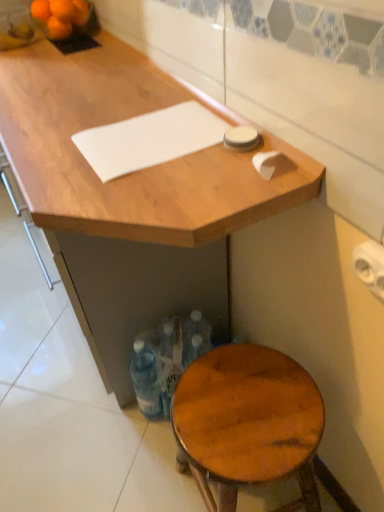
You are a GUI agent. You are given a task and a screenshot of the screen. Output one action in this format:
    pyautogui.click(x=<x>, y=<y>)
    Task: Click on the wooden stool at lower right
    This screenshot has height=512, width=384.
    Given the screenshot: What is the action you would take?
    pyautogui.click(x=247, y=422)

Measure the distance between orange matte tangerine at upper left, the 3th tangerine positioned from the front, and camera.

A distance of 1.39 meters exists between orange matte tangerine at upper left, the 3th tangerine positioned from the front, and camera.

I want to click on orange matte tangerine at upper left, the 3th tangerine positioned from the front, so click(x=80, y=12).

Where is `orange matte tangerine at upper left, acting as the first tangerine starting from the back`? orange matte tangerine at upper left, acting as the first tangerine starting from the back is located at coordinates (60, 16).

How much space does orange matte tangerine at upper left, the fourth tangerine in the front-to-back sequence, occupy horizontally?

It is 6.36 inches.

This screenshot has width=384, height=512. What do you see at coordinates (40, 10) in the screenshot? I see `orange matte at upper left` at bounding box center [40, 10].

The width and height of the screenshot is (384, 512). What do you see at coordinates (132, 197) in the screenshot?
I see `wooden desk at center` at bounding box center [132, 197].

You are a GUI agent. You are given a task and a screenshot of the screen. Output one action in this format:
    pyautogui.click(x=<x>, y=<y>)
    Task: Click on the wooden stool at lower right
    This screenshot has width=384, height=512.
    Given the screenshot: What is the action you would take?
    pyautogui.click(x=247, y=422)

Is white paper towel at upper right directly adjacent to wooden desk at center?

No, white paper towel at upper right is not in contact with wooden desk at center.

From a real-world perspective, is white paper towel at upper right on top of wooden desk at center?

Indeed, from a real-world perspective, white paper towel at upper right stands above wooden desk at center.

Considering the relative positions of white paper towel at upper right and wooden desk at center in the image provided, is white paper towel at upper right to the left of wooden desk at center from the viewer's perspective?

No, white paper towel at upper right is not to the left of wooden desk at center.

Does point (78, 16) appear closer or farther from the camera than point (356, 252)?

Point (78, 16) is farther from the camera than point (356, 252).

In the image, there is a orange matte tangerine at upper left, which ranks as the second tangerine in back-to-front order. Where is `toilet paper below it (from the image's perspective)`? Image resolution: width=384 pixels, height=512 pixels. toilet paper below it (from the image's perspective) is located at coordinates (370, 266).

Between orange matte tangerine at upper left, which ranks as the second tangerine in back-to-front order, and white paper towel at upper right, which one has more height?

white paper towel at upper right is taller.

Is translucent plastic bottles at lower center completely or partially outside of orange matte at upper left?

translucent plastic bottles at lower center is positioned outside orange matte at upper left.

In order to click on bottle in front of the orange matte at upper left in this screenshot , I will do `click(166, 360)`.

Is point (185, 343) positioned after point (47, 9)?

No, (185, 343) is closer to viewer.

Is orange matte tangerine at upper left, the 4th tangerine positioned from the back, touching translucent plastic bottles at lower center?

orange matte tangerine at upper left, the 4th tangerine positioned from the back, is not next to translucent plastic bottles at lower center, and they're not touching.

Where is `bottle on the right of orange matte tangerine at upper left, the 4th tangerine positioned from the back`? bottle on the right of orange matte tangerine at upper left, the 4th tangerine positioned from the back is located at coordinates (166, 360).

Is orange matte tangerine at upper left, which is the first tangerine from front to back, in front of or behind translucent plastic bottles at lower center in the image?

Visually, orange matte tangerine at upper left, which is the first tangerine from front to back, is located behind translucent plastic bottles at lower center.

Is point (63, 20) positioned behind point (194, 335)?

Yes, it is behind point (194, 335).

From a real-world perspective, is white matte cutting board at upper center located higher than wooden desk at center?

Correct, in the physical world, white matte cutting board at upper center is higher than wooden desk at center.

Is white matte cutting board at upper center far from wooden desk at center?

No, white matte cutting board at upper center is not far away from wooden desk at center.

From the image's perspective, between white matte cutting board at upper center and wooden desk at center, which one is located above?

white matte cutting board at upper center is shown above in the image.

Which is more to the left, orange matte tangerine at upper left, the fourth tangerine in the front-to-back sequence, or white matte cutting board at upper center?

Positioned to the left is orange matte tangerine at upper left, the fourth tangerine in the front-to-back sequence.

Is orange matte tangerine at upper left, acting as the first tangerine starting from the back, oriented towards white matte cutting board at upper center?

No, orange matte tangerine at upper left, acting as the first tangerine starting from the back, is not facing towards white matte cutting board at upper center.

From a real-world perspective, is orange matte tangerine at upper left, the fourth tangerine in the front-to-back sequence, located higher than white matte cutting board at upper center?

Yes, from a real-world perspective, orange matte tangerine at upper left, the fourth tangerine in the front-to-back sequence, is above white matte cutting board at upper center.

Can you tell me how much orange matte tangerine at upper left, the fourth tangerine in the front-to-back sequence, and white matte cutting board at upper center differ in facing direction?

The facing directions of orange matte tangerine at upper left, the fourth tangerine in the front-to-back sequence, and white matte cutting board at upper center are 2.53 degrees apart.

Consider the image. Is translucent plastic bottles at lower center placed right next to orange matte tangerine at upper left, which ranks as the second tangerine in back-to-front order?

translucent plastic bottles at lower center is not next to orange matte tangerine at upper left, which ranks as the second tangerine in back-to-front order, and they're not touching.

Does point (157, 332) appear closer or farther from the camera than point (78, 18)?

Point (157, 332) is positioned closer to the camera compared to point (78, 18).

Which object is closer to the camera taking this photo, translucent plastic bottles at lower center or orange matte tangerine at upper left, which ranks as the second tangerine in back-to-front order?

translucent plastic bottles at lower center is more forward.

Is translucent plastic bottles at lower center facing away from orange matte tangerine at upper left, the 3th tangerine positioned from the front?

That's not correct — translucent plastic bottles at lower center is not looking away from orange matte tangerine at upper left, the 3th tangerine positioned from the front.

In the image, there is a wooden desk at center. What are the coordinates of `toilet paper below it (from the image's perspective)` in the screenshot? It's located at (370, 266).

Locate an element on the screen. the 1st tangerine to the left of the white paper towel at upper right, counting from the anchor's position is located at coordinates (80, 12).

Estimate the real-world distances between objects in this image. Which object is closer to wooden desk at center, orange matte tangerine at upper left, which is the first tangerine from front to back, or orange matte at upper left?

orange matte tangerine at upper left, which is the first tangerine from front to back, lies closer to wooden desk at center than the other object.

From the image, which object appears to be farther from orange matte tangerine at upper left, the 3th tangerine positioned from the front, orange matte tangerine at upper left, the fourth tangerine in the front-to-back sequence, or translucent plastic bottles at lower center?

Among the two, translucent plastic bottles at lower center is located further to orange matte tangerine at upper left, the 3th tangerine positioned from the front.

Estimate the real-world distances between objects in this image. Which object is closer to orange matte tangerine at upper left, acting as the first tangerine starting from the back, translucent plastic bottles at lower center or wooden stool at lower right?

translucent plastic bottles at lower center.

Estimate the real-world distances between objects in this image. Which object is further from orange matte tangerine at upper left, the fourth tangerine in the front-to-back sequence, orange matte tangerine at upper left, the 3th tangerine positioned from the front, or white matte cutting board at upper center?

white matte cutting board at upper center lies further to orange matte tangerine at upper left, the fourth tangerine in the front-to-back sequence, than the other object.

Considering their positions, is orange matte tangerine at upper left, which is the first tangerine from front to back, positioned further to orange matte tangerine at upper left, which ranks as the second tangerine in back-to-front order, than orange matte tangerine at upper left, the 2th tangerine from the front?

orange matte tangerine at upper left, the 2th tangerine from the front, is further to orange matte tangerine at upper left, which ranks as the second tangerine in back-to-front order.

Which object lies nearer to the anchor point wooden desk at center, wooden stool at lower right or white paper towel at upper right?

The object closer to wooden desk at center is wooden stool at lower right.

Estimate the real-world distances between objects in this image. Which object is closer to orange matte at upper left, white matte cutting board at upper center or orange matte tangerine at upper left, which is the first tangerine from front to back?

Based on the image, orange matte tangerine at upper left, which is the first tangerine from front to back, appears to be nearer to orange matte at upper left.

Based on their spatial positions, is orange matte tangerine at upper left, which is the first tangerine from front to back, or orange matte tangerine at upper left, the 3th tangerine positioned from the front, further from orange matte tangerine at upper left, placed as the third tangerine when sorted from back to front?

orange matte tangerine at upper left, the 3th tangerine positioned from the front, is positioned further to the anchor orange matte tangerine at upper left, placed as the third tangerine when sorted from back to front.

The width and height of the screenshot is (384, 512). What are the coordinates of `tangerine between orange matte tangerine at upper left, the 4th tangerine positioned from the back, and translucent plastic bottles at lower center in the up-down direction` in the screenshot? It's located at (59, 28).

Find the location of `notepad between orange matte tangerine at upper left, the fourth tangerine in the front-to-back sequence, and translucent plastic bottles at lower center from top to bottom`. notepad between orange matte tangerine at upper left, the fourth tangerine in the front-to-back sequence, and translucent plastic bottles at lower center from top to bottom is located at coordinates (149, 139).

Identify the location of orange between wooden desk at center and orange matte tangerine at upper left, placed as the third tangerine when sorted from back to front, from front to back. The width and height of the screenshot is (384, 512). (40, 10).

You are a GUI agent. You are given a task and a screenshot of the screen. Output one action in this format:
    pyautogui.click(x=<x>, y=<y>)
    Task: Click on the desk that lies between orange matte at upper left and translucent plastic bottles at lower center from top to bottom
    
    Given the screenshot: What is the action you would take?
    pyautogui.click(x=132, y=197)